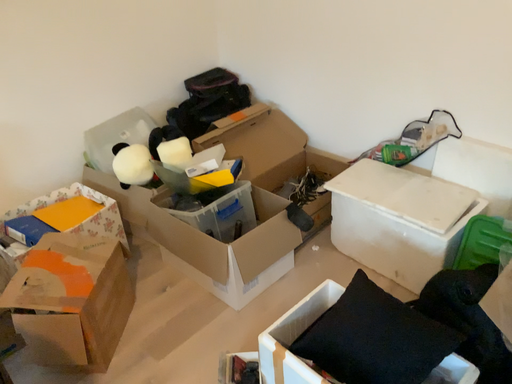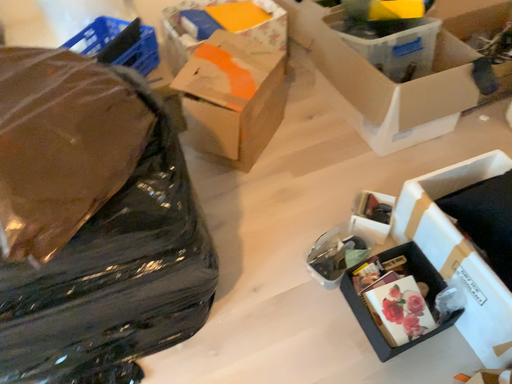
Question: Which way did the camera rotate in the video?

Choices:
 (A) rotated left
 (B) rotated right

Answer: (A)